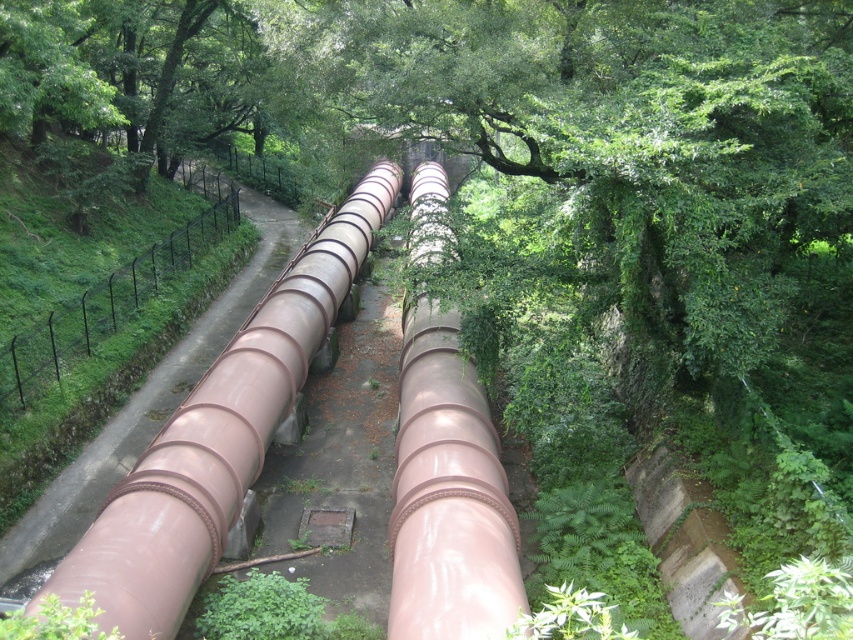
You are a maintenance worker needing to inspect both the glossy metallic pipe at center and the glossy metallic water pipe at center. Which one should you check first if you want to start from the top?

You should check the glossy metallic pipe at center first because it is positioned over the glossy metallic water pipe at center, making it accessible from the top.

You are a maintenance worker needing to access both the glossy metallic water pipe at center and the black metal fence at left. Based on their heights, which one would you need to look up more to inspect?

The glossy metallic water pipe at center is taller than the black metal fence at left, so you would need to look up more to inspect the glossy metallic water pipe at center.